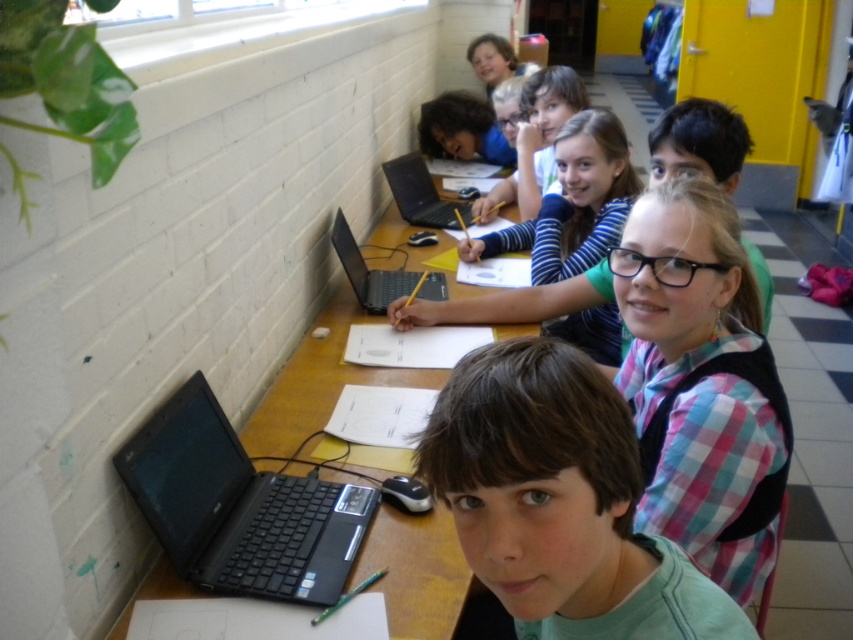
Question: Is the position of black plastic laptop at center less distant than that of black matte laptop at center?

Choices:
 (A) no
 (B) yes

Answer: (B)

Question: Is green matte shirt at center smaller than pink plaid shirt at center?

Choices:
 (A) no
 (B) yes

Answer: (B)

Question: Among these objects, which one is farthest from the camera?

Choices:
 (A) green matte shirt at center
 (B) pink plaid shirt at center
 (C) black plastic laptop at center
 (D) plaid fabric shirt at center

Answer: (C)

Question: Does plaid fabric shirt at center have a lesser width compared to black plastic laptop at center?

Choices:
 (A) yes
 (B) no

Answer: (A)

Question: Which of the following is the closest to the observer?

Choices:
 (A) green matte shirt at center
 (B) plaid fabric shirt at center
 (C) striped sweater at center
 (D) black plastic laptop at center

Answer: (A)

Question: Which point is farther from the camera taking this photo?

Choices:
 (A) (454, 557)
 (B) (526, 106)

Answer: (B)